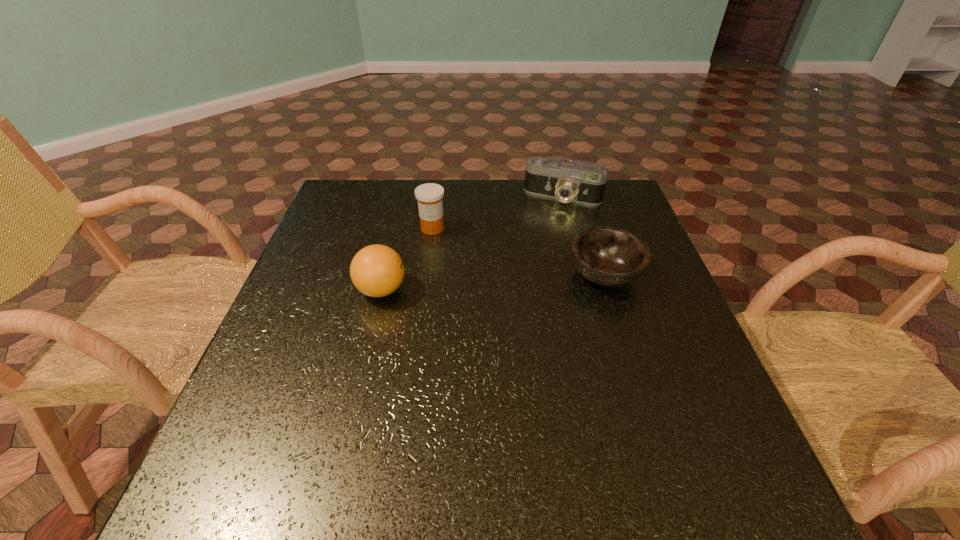
Locate an element on the screen. The width and height of the screenshot is (960, 540). vacant area that lies between the leftmost object and the farthest object is located at coordinates (472, 244).

At what (x,y) coordinates should I click in order to perform the action: click on vacant region between the shortest object and the leftmost object. Please return your answer as a coordinate pair (x, y). This screenshot has width=960, height=540. Looking at the image, I should click on tap(493, 283).

The image size is (960, 540). I want to click on empty space between the bowl and the third nearest object, so [518, 252].

Locate an element on the screen. The height and width of the screenshot is (540, 960). vacant region between the leftmost object and the medicine is located at coordinates (407, 259).

At what (x,y) coordinates should I click in order to perform the action: click on object that is the closest to the third nearest object. Please return your answer as a coordinate pair (x, y). Looking at the image, I should click on (377, 270).

This screenshot has width=960, height=540. What are the coordinates of `the closest object relative to the second farthest object` in the screenshot? It's located at (377, 270).

Where is `vacant space that satisfies the following two spatial constraints: 1. on the front side of the bowl; 2. on the right side of the medicine`? Image resolution: width=960 pixels, height=540 pixels. vacant space that satisfies the following two spatial constraints: 1. on the front side of the bowl; 2. on the right side of the medicine is located at coordinates (426, 275).